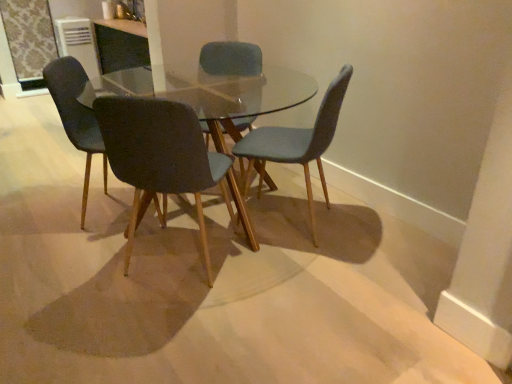
You are a GUI agent. You are given a task and a screenshot of the screen. Output one action in this format:
    pyautogui.click(x=<x>, y=<y>)
    Task: Click on the vacant area situated to the left side of matte black chair at center, marked as the 3th chair in a right-to-left arrangement
    The height and width of the screenshot is (384, 512).
    Given the screenshot: What is the action you would take?
    pyautogui.click(x=81, y=268)